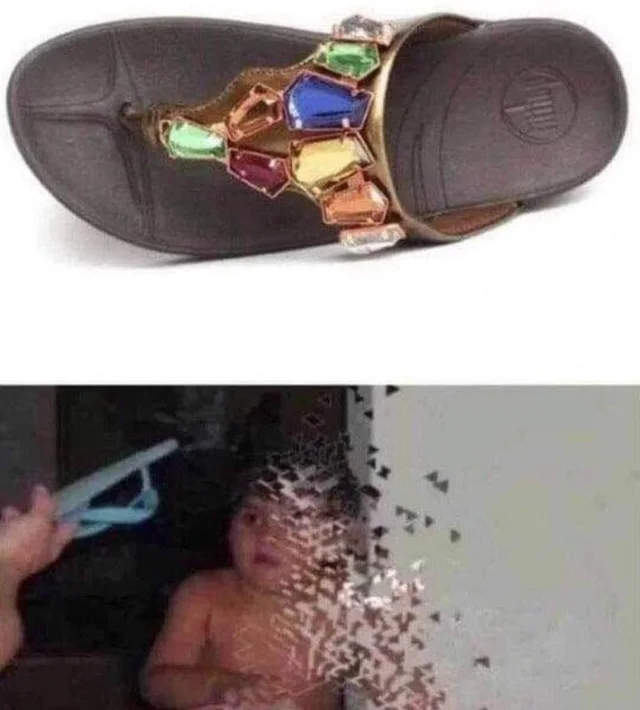
Where is `walls`? The image size is (640, 710). walls is located at coordinates (556, 508), (43, 422).